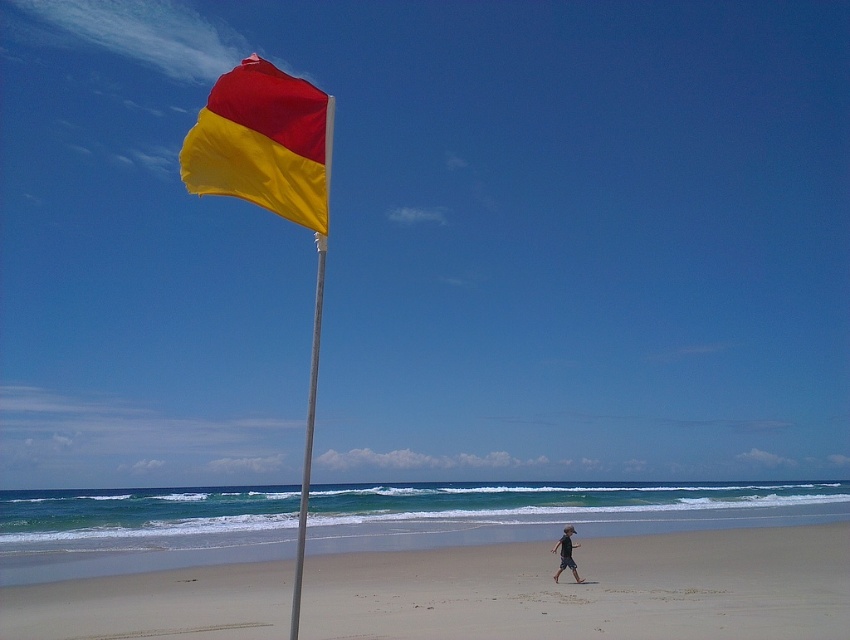
You are standing on the sandy beach at center and want to walk towards the silver metallic flag pole at left. Which direction should you face to move closer to the flag pole?

Since the sandy beach at center is further away from you than the silver metallic flag pole at left, you should face towards the left to move closer to the flag pole.